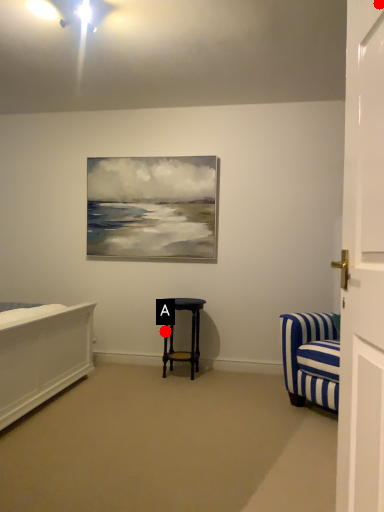
Question: Two points are circled on the image, labeled by A and B beside each circle. Which point appears closest to the camera in this image?

Choices:
 (A) A is closer
 (B) B is closer

Answer: (B)